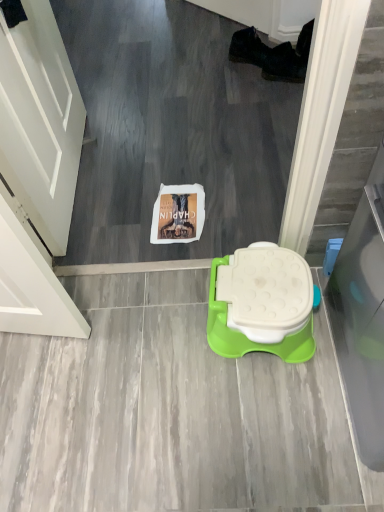
Question: Is white plastic toilet at center directly adjacent to white matte door at upper left?

Choices:
 (A) yes
 (B) no

Answer: (B)

Question: Does white plastic toilet at center have a lesser width compared to white matte door at upper left?

Choices:
 (A) no
 (B) yes

Answer: (A)

Question: From the image's perspective, would you say white plastic toilet at center is shown under white matte door at upper left?

Choices:
 (A) yes
 (B) no

Answer: (A)

Question: Can we say white plastic toilet at center lies outside white matte door at upper left?

Choices:
 (A) no
 (B) yes

Answer: (B)

Question: Can you confirm if white plastic toilet at center is shorter than white matte door at upper left?

Choices:
 (A) no
 (B) yes

Answer: (B)

Question: From the image's perspective, is white plastic toilet at center on white matte door at upper left?

Choices:
 (A) yes
 (B) no

Answer: (B)

Question: From the image's perspective, is white matte door at upper left beneath white plastic toilet at center?

Choices:
 (A) no
 (B) yes

Answer: (A)

Question: Is the depth of white matte door at upper left greater than that of white plastic toilet at center?

Choices:
 (A) no
 (B) yes

Answer: (A)

Question: Would you say white matte door at upper left is outside white plastic toilet at center?

Choices:
 (A) yes
 (B) no

Answer: (A)

Question: Considering the relative sizes of white matte door at upper left and white plastic toilet at center in the image provided, is white matte door at upper left smaller than white plastic toilet at center?

Choices:
 (A) no
 (B) yes

Answer: (B)

Question: Is white matte door at upper left to the left of white plastic toilet at center from the viewer's perspective?

Choices:
 (A) no
 (B) yes

Answer: (B)

Question: Can you confirm if white matte door at upper left is shorter than white plastic toilet at center?

Choices:
 (A) no
 (B) yes

Answer: (A)

Question: From the image's perspective, relative to white plastic toilet at center, is white matte door at upper left above or below?

Choices:
 (A) above
 (B) below

Answer: (A)